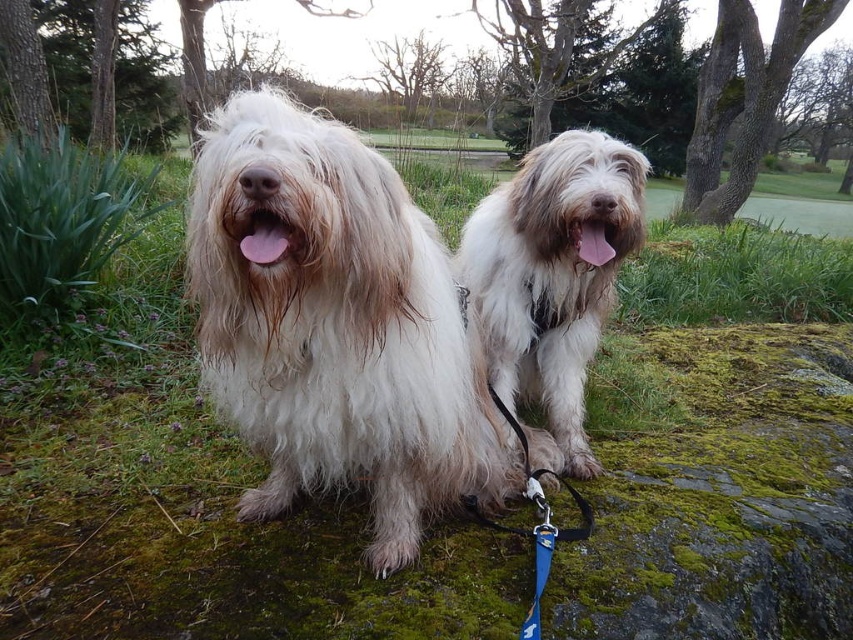
You are a dog owner who wants to ensure both dogs have enough space to lie down comfortably. Given that the mossy rock they are sitting on is only 1 meter wide, can both the white fluffy dog at center and the fuzzy white dog at center fit side by side on it?

The white fluffy dog at center is taller than the fuzzy white dog at center. Since the rock is only 1 meter wide, and the taller dog might require more space, it is possible that both may not fit comfortably side by side depending on their exact sizes.

You are a dog trainer assessing the image. You need to determine which object is taller between the fuzzy white dog at center and the blue fabric leash at center. Based on the scene, which one is taller?

The fuzzy white dog at center is much taller than the blue fabric leash at center.